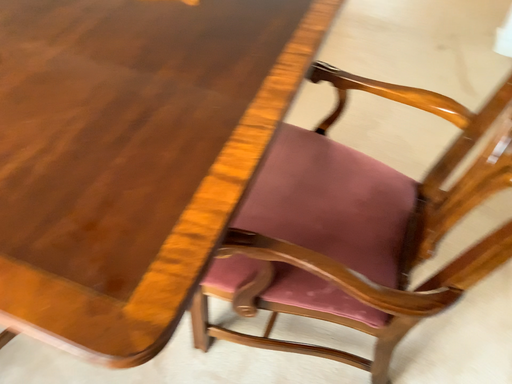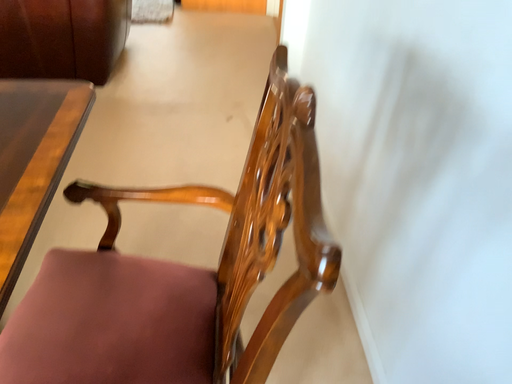
Question: Which way did the camera rotate in the video?

Choices:
 (A) rotated right
 (B) rotated left

Answer: (A)